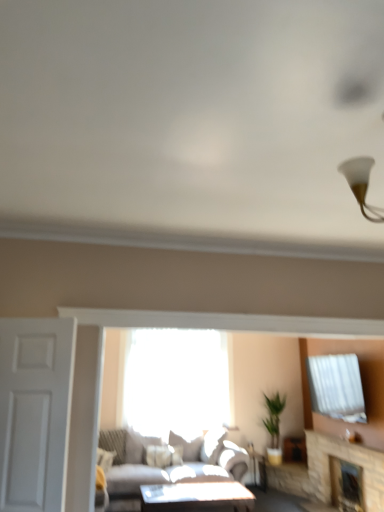
Question: Looking at their shapes, would you say light gray fabric couch at center is wider or thinner than transparent glass window at center?

Choices:
 (A) thin
 (B) wide

Answer: (B)

Question: From the image's perspective, is light gray fabric couch at center located above or below transparent glass window at center?

Choices:
 (A) above
 (B) below

Answer: (B)

Question: Estimate the real-world distances between objects in this image. Which object is closer to the white matte door at left?

Choices:
 (A) light gray fabric couch at center
 (B) transparent glass window at center
 (C) matte white side table at lower center
 (D) stone fireplace at lower right, the second fireplace in the back-to-front sequence
 (E) stone fireplace at lower right, marked as the second fireplace in a front-to-back arrangement

Answer: (A)

Question: Which object is the farthest from the light gray fabric couch at center?

Choices:
 (A) white matte door at left
 (B) matte white table at center
 (C) transparent glass window at center
 (D) stone fireplace at lower right, the first fireplace positioned from the front
 (E) matte white side table at lower center

Answer: (A)